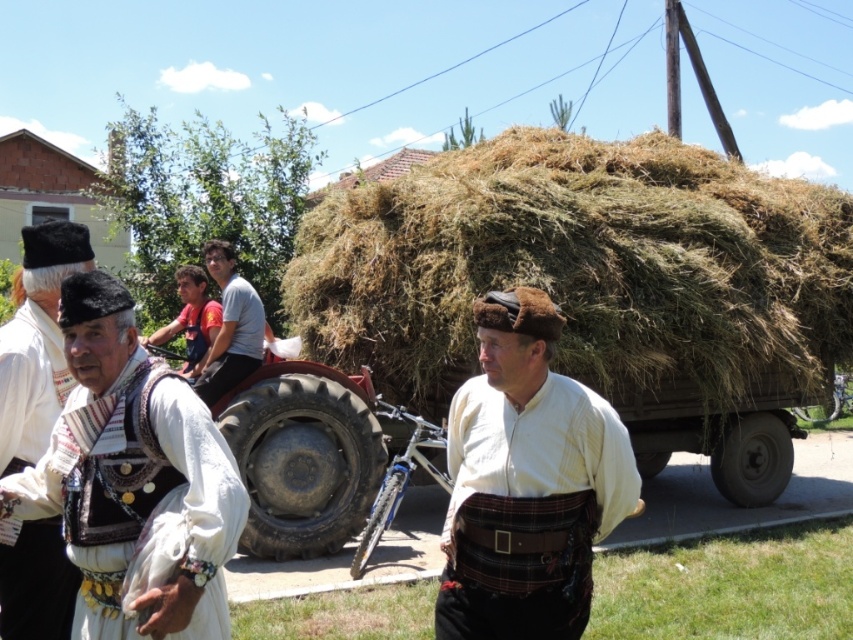
Does white embroidered vest at center have a larger size compared to red fabric shirt at center?

Yes, white embroidered vest at center is bigger than red fabric shirt at center.

Who is higher up, white embroidered vest at center or red fabric shirt at center?

red fabric shirt at center

Locate an element on the screen. white embroidered vest at center is located at coordinates (175, 524).

Can you confirm if white embroidered vest at center is thinner than light gray cotton shirt at center?

No.

Between white embroidered vest at center and light gray cotton shirt at center, which one appears on the left side from the viewer's perspective?

light gray cotton shirt at center is more to the left.

Who is more distant from viewer, (x=181, y=406) or (x=260, y=348)?

The point (x=260, y=348) is behind.

Where is `white embroidered vest at center`? This screenshot has height=640, width=853. white embroidered vest at center is located at coordinates (175, 524).

The height and width of the screenshot is (640, 853). What do you see at coordinates (230, 326) in the screenshot?
I see `light gray cotton shirt at center` at bounding box center [230, 326].

How distant is light gray cotton shirt at center from red fabric shirt at center?

A distance of 28.21 centimeters exists between light gray cotton shirt at center and red fabric shirt at center.

Does point (254, 339) come behind point (184, 307)?

That is False.

At what (x,y) coordinates should I click in order to perform the action: click on light gray cotton shirt at center. Please return your answer as a coordinate pair (x, y). Looking at the image, I should click on (230, 326).